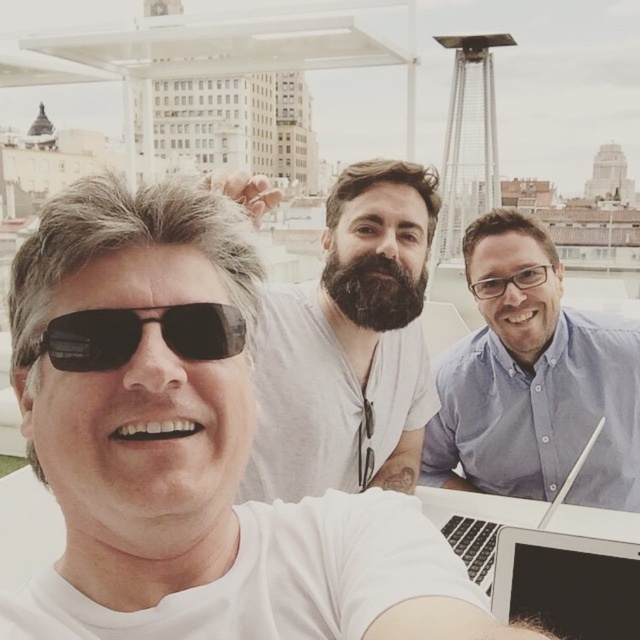
Between silver metallic laptop at center and silver metallic laptop at lower right, which one has more height?

silver metallic laptop at lower right

Is point (608, 618) less distant than point (486, 550)?

That is True.

Identify the location of silver metallic laptop at center. This screenshot has width=640, height=640. (566, 582).

Locate an element on the screen. The height and width of the screenshot is (640, 640). silver metallic laptop at center is located at coordinates [x=566, y=582].

Is bearded man at center shorter than silver metallic laptop at center?

In fact, bearded man at center may be taller than silver metallic laptop at center.

At what (x,y) coordinates should I click in order to perform the action: click on bearded man at center. Please return your answer as a coordinate pair (x, y). This screenshot has width=640, height=640. Looking at the image, I should click on (349, 346).

Does blue button-down shirt at center lie in front of silver metallic laptop at lower right?

No, blue button-down shirt at center is further to the viewer.

Between point (442, 384) and point (474, 502), which one is positioned behind?

The point (442, 384) is more distant.

Where is `blue button-down shirt at center`? This screenshot has height=640, width=640. blue button-down shirt at center is located at coordinates (532, 380).